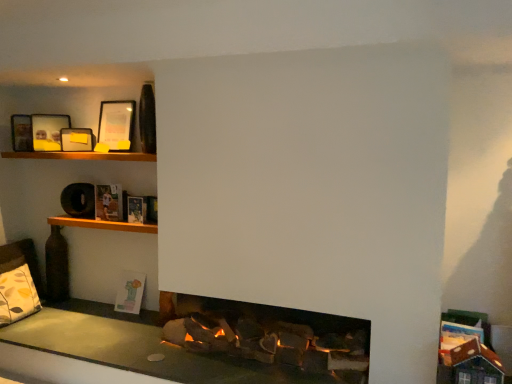
Identify the location of hardcover book at upper left, which is counted as the 3th book, starting from the back. (136, 210).

The image size is (512, 384). I want to click on wooden shelf at upper left, acting as the second shelf starting from the top, so click(x=102, y=224).

You are a GUI agent. You are given a task and a screenshot of the screen. Output one action in this format:
    pyautogui.click(x=<x>, y=<y>)
    Task: Click on the matte black picture frame at upper left, which appears as the third picture frame when viewed from the right
    
    Given the screenshot: What is the action you would take?
    pyautogui.click(x=48, y=131)

What do you see at coordinates (48, 131) in the screenshot?
I see `matte black picture frame at upper left, which appears as the third picture frame when viewed from the right` at bounding box center [48, 131].

Find the location of `wooden shelf at upper left, the second shelf when ordered from bottom to top`. wooden shelf at upper left, the second shelf when ordered from bottom to top is located at coordinates (83, 156).

Is pastel paper book at lower left, which ranks as the 3th book in front-to-back order, not inside wooden shelf at upper left, marked as the 1th shelf in a bottom-to-top arrangement?

pastel paper book at lower left, which ranks as the 3th book in front-to-back order, is positioned outside wooden shelf at upper left, marked as the 1th shelf in a bottom-to-top arrangement.

Is pastel paper book at lower left, positioned as the first book in bottom-to-top order, taller or shorter than wooden shelf at upper left, acting as the second shelf starting from the top?

In the image, pastel paper book at lower left, positioned as the first book in bottom-to-top order, appears to be taller than wooden shelf at upper left, acting as the second shelf starting from the top.

Can you confirm if pastel paper book at lower left, which ranks as the 3th book in front-to-back order, is positioned to the left of wooden shelf at upper left, marked as the 1th shelf in a bottom-to-top arrangement?

In fact, pastel paper book at lower left, which ranks as the 3th book in front-to-back order, is to the right of wooden shelf at upper left, marked as the 1th shelf in a bottom-to-top arrangement.

Can you confirm if pastel paper book at lower left, which is the first book from back to front, is shorter than matte black picture frame at upper left, acting as the first picture frame starting from the left?

Incorrect, the height of pastel paper book at lower left, which is the first book from back to front, does not fall short of that of matte black picture frame at upper left, acting as the first picture frame starting from the left.

Is pastel paper book at lower left, the 3th book when ordered from top to bottom, turned away from matte black picture frame at upper left, acting as the first picture frame starting from the left?

No.

From the image's perspective, would you say pastel paper book at lower left, which is the first book from back to front, is shown under matte black picture frame at upper left, which appears as the third picture frame when viewed from the right?

Correct, pastel paper book at lower left, which is the first book from back to front, appears lower than matte black picture frame at upper left, which appears as the third picture frame when viewed from the right, in the image.

In the scene shown: Choose the correct answer: Is pastel paper book at lower left, positioned as the first book in bottom-to-top order, inside matte black picture frame at upper left, acting as the first picture frame starting from the left, or outside it?

pastel paper book at lower left, positioned as the first book in bottom-to-top order, exists outside the volume of matte black picture frame at upper left, acting as the first picture frame starting from the left.

Would you say hardcover book at upper left, the first book viewed from the top, is part of matte black picture frame at upper left, acting as the first picture frame starting from the left,'s contents?

Definitely not — hardcover book at upper left, the first book viewed from the top, is not inside matte black picture frame at upper left, acting as the first picture frame starting from the left.

Is matte black picture frame at upper left, which appears as the third picture frame when viewed from the right, taller or shorter than hardcover book at upper left, the third book positioned from the bottom?

matte black picture frame at upper left, which appears as the third picture frame when viewed from the right, is taller than hardcover book at upper left, the third book positioned from the bottom.

How many degrees apart are the facing directions of matte black picture frame at upper left, which appears as the third picture frame when viewed from the right, and hardcover book at upper left, acting as the second book starting from the front?

The angle between the facing direction of matte black picture frame at upper left, which appears as the third picture frame when viewed from the right, and the facing direction of hardcover book at upper left, acting as the second book starting from the front, is 54.2 degrees.

Considering the positions of objects matte black picture frame at upper left, acting as the first picture frame starting from the left, and hardcover book at upper left, acting as the second book starting from the back, in the image provided, who is more to the right, matte black picture frame at upper left, acting as the first picture frame starting from the left, or hardcover book at upper left, acting as the second book starting from the back,?

Positioned to the right is hardcover book at upper left, acting as the second book starting from the back.

Which is in front, point (38, 305) or point (93, 141)?

The point (93, 141) is more forward.

You are a GUI agent. You are given a task and a screenshot of the screen. Output one action in this format:
    pyautogui.click(x=<x>, y=<y>)
    Task: Click on the pillow in front of the matte black picture frame at upper left, the 2th picture frame viewed from the left
    The image size is (512, 384).
    Given the screenshot: What is the action you would take?
    pyautogui.click(x=17, y=295)

From a real-world perspective, between patterned fabric pillow at lower left and matte black picture frame at upper left, the 2th picture frame viewed from the left, who is vertically lower?

In real-world perspective, patterned fabric pillow at lower left is lower.

Looking at this image, can you tell me how much patterned fabric pillow at lower left and matte black picture frame at upper left, the 2th picture frame when ordered from right to left, differ in facing direction?

There is a 29-degree angle between the facing directions of patterned fabric pillow at lower left and matte black picture frame at upper left, the 2th picture frame when ordered from right to left.

Is point (117, 296) positioned after point (146, 208)?

Yes, it is.

From a real-world perspective, who is located higher, pastel paper book at lower left, which is the first book from back to front, or hardcover book at upper left, placed as the second book when sorted from bottom to top?

hardcover book at upper left, placed as the second book when sorted from bottom to top.

Between pastel paper book at lower left, which is the first book from back to front, and hardcover book at upper left, which is counted as the 3th book, starting from the back, which one has smaller width?

Thinner between the two is hardcover book at upper left, which is counted as the 3th book, starting from the back.

From a real-world perspective, is wooden shelf at upper left, the second shelf when ordered from bottom to top, on top of matte black picture frame at upper left, the 2th picture frame when ordered from right to left?

Incorrect, from a real-world perspective, wooden shelf at upper left, the second shelf when ordered from bottom to top, is lower than matte black picture frame at upper left, the 2th picture frame when ordered from right to left.

How many degrees apart are the facing directions of wooden shelf at upper left, placed as the 1th shelf when sorted from top to bottom, and matte black picture frame at upper left, the 2th picture frame when ordered from right to left?

56.3 degrees separate the facing orientations of wooden shelf at upper left, placed as the 1th shelf when sorted from top to bottom, and matte black picture frame at upper left, the 2th picture frame when ordered from right to left.

Is wooden shelf at upper left, the second shelf when ordered from bottom to top, to the right of matte black picture frame at upper left, the 2th picture frame viewed from the left, from the viewer's perspective?

Indeed, wooden shelf at upper left, the second shelf when ordered from bottom to top, is positioned on the right side of matte black picture frame at upper left, the 2th picture frame viewed from the left.

Who is shorter, wooden shelf at upper left, the second shelf when ordered from bottom to top, or matte black picture frame at upper left, the 2th picture frame when ordered from right to left?

With less height is wooden shelf at upper left, the second shelf when ordered from bottom to top.

What's the angular difference between wooden shelf at upper left, marked as the 1th shelf in a bottom-to-top arrangement, and patterned fabric pillow at lower left's facing directions?

wooden shelf at upper left, marked as the 1th shelf in a bottom-to-top arrangement, and patterned fabric pillow at lower left are facing 85.3 degrees away from each other.

Does wooden shelf at upper left, acting as the second shelf starting from the top, have a lesser width compared to patterned fabric pillow at lower left?

No, wooden shelf at upper left, acting as the second shelf starting from the top, is not thinner than patterned fabric pillow at lower left.

Who is bigger, wooden shelf at upper left, marked as the 1th shelf in a bottom-to-top arrangement, or patterned fabric pillow at lower left?

Bigger between the two is patterned fabric pillow at lower left.

Considering the sizes of objects wooden shelf at upper left, marked as the 1th shelf in a bottom-to-top arrangement, and patterned fabric pillow at lower left in the image provided, who is shorter, wooden shelf at upper left, marked as the 1th shelf in a bottom-to-top arrangement, or patterned fabric pillow at lower left?

wooden shelf at upper left, marked as the 1th shelf in a bottom-to-top arrangement.

From a real-world perspective, starting from the pastel paper book at lower left, which is the first book from back to front, which shelf is the 1st one vertically above it? Please provide its 2D coordinates.

[(102, 224)]

Locate an element on the screen. book that is behind the matte black picture frame at upper left, acting as the first picture frame starting from the left is located at coordinates (130, 292).

From the image, which object appears to be farther from hardcover book at upper left, the third book positioned from the bottom, hardcover book at upper left, arranged as the first book when viewed from the front, or pastel paper book at lower left, which ranks as the 3th book in front-to-back order?

The object further to hardcover book at upper left, the third book positioned from the bottom, is pastel paper book at lower left, which ranks as the 3th book in front-to-back order.

Estimate the real-world distances between objects in this image. Which object is closer to hardcover book at upper left, the first book viewed from the top, matte black picture frame at upper left, the third picture frame viewed from the left, or matte black picture frame at upper left, acting as the first picture frame starting from the left?

matte black picture frame at upper left, the third picture frame viewed from the left.

Looking at the image, which one is located closer to hardcover book at upper left, which is counted as the 2th book, starting from the top, wooden shelf at upper left, the second shelf when ordered from bottom to top, or pastel paper book at lower left, which ranks as the 3th book in front-to-back order?

Among the two, wooden shelf at upper left, the second shelf when ordered from bottom to top, is located nearer to hardcover book at upper left, which is counted as the 2th book, starting from the top.

From the image, which object appears to be farther from matte black picture frame at upper left, acting as the first picture frame starting from the left, matte black picture frame at upper left, the 2th picture frame when ordered from right to left, or wooden shelf at upper left, marked as the 1th shelf in a bottom-to-top arrangement?

The object further to matte black picture frame at upper left, acting as the first picture frame starting from the left, is wooden shelf at upper left, marked as the 1th shelf in a bottom-to-top arrangement.

Which object lies further to the anchor point matte black picture frame at upper left, acting as the first picture frame starting from the left, patterned fabric pillow at lower left or hardcover book at upper left, which is counted as the 2th book, starting from the top?

patterned fabric pillow at lower left.

From the image, which object appears to be nearer to wooden shelf at upper left, acting as the second shelf starting from the top, hardcover book at upper left, which is counted as the 3th book, starting from the back, or wooden shelf at upper left, placed as the 1th shelf when sorted from top to bottom?

hardcover book at upper left, which is counted as the 3th book, starting from the back, is positioned closer to the anchor wooden shelf at upper left, acting as the second shelf starting from the top.

Which object lies further to the anchor point patterned fabric pillow at lower left, wooden shelf at upper left, acting as the second shelf starting from the top, or matte black picture frame at upper left, acting as the first picture frame starting from the left?

matte black picture frame at upper left, acting as the first picture frame starting from the left, is further to patterned fabric pillow at lower left.

Considering their positions, is matte black picture frame at upper left, which appears as the third picture frame when viewed from the right, positioned closer to matte black picture frame at upper left, the first picture frame viewed from the right, than matte black picture frame at upper left, the 2th picture frame when ordered from right to left?

The object closer to matte black picture frame at upper left, the first picture frame viewed from the right, is matte black picture frame at upper left, the 2th picture frame when ordered from right to left.

In order to click on book between matte black picture frame at upper left, the third picture frame viewed from the left, and hardcover book at upper left, arranged as the first book when viewed from the front, in the vertical direction in this screenshot , I will do `click(108, 202)`.

At what (x,y) coordinates should I click in order to perform the action: click on shelf between matte black picture frame at upper left, acting as the first picture frame starting from the left, and wooden shelf at upper left, acting as the second shelf starting from the top, from top to bottom. Please return your answer as a coordinate pair (x, y). Image resolution: width=512 pixels, height=384 pixels. Looking at the image, I should click on (83, 156).

You are a GUI agent. You are given a task and a screenshot of the screen. Output one action in this format:
    pyautogui.click(x=<x>, y=<y>)
    Task: Click on the shelf between wooden shelf at upper left, placed as the 1th shelf when sorted from top to bottom, and pastel paper book at lower left, which ranks as the 3th book in front-to-back order, vertically
    
    Given the screenshot: What is the action you would take?
    pyautogui.click(x=102, y=224)

Identify the location of picture frame that lies between matte black picture frame at upper left, acting as the first picture frame starting from the left, and hardcover book at upper left, acting as the second book starting from the back, from top to bottom. Image resolution: width=512 pixels, height=384 pixels. (76, 139).